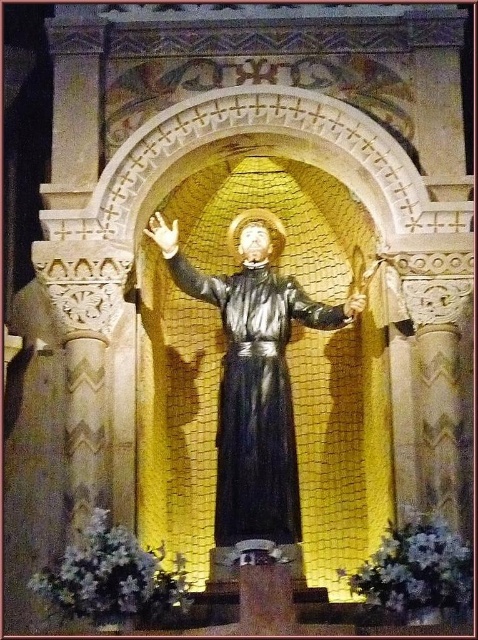
Does black matte robe at center appear under matte white hand at center?

Yes, black matte robe at center is below matte white hand at center.

Who is taller, black matte robe at center or matte white hand at center?

Standing taller between the two is black matte robe at center.

Locate an element on the screen. This screenshot has width=478, height=640. black matte robe at center is located at coordinates (256, 397).

Is black matte robe at center closer to the viewer compared to matte gold chain at upper center?

Yes.

Consider the image. Is black matte robe at center thinner than matte gold chain at upper center?

No.

Between point (258, 381) and point (364, 305), which one is positioned in front?

Point (364, 305) is in front.

Identify the location of black matte robe at center. This screenshot has height=640, width=478. (256, 397).

Is matte white hand at center behind matte gold chain at upper center?

Yes, matte white hand at center is further from the viewer.

Is matte white hand at center shorter than matte gold chain at upper center?

No.

You are a GUI agent. You are given a task and a screenshot of the screen. Output one action in this format:
    pyautogui.click(x=<x>, y=<y>)
    Task: Click on the matte white hand at center
    
    Given the screenshot: What is the action you would take?
    pyautogui.click(x=162, y=234)

Locate an element on the screen. Image resolution: width=478 pixels, height=640 pixels. matte white hand at center is located at coordinates (162, 234).